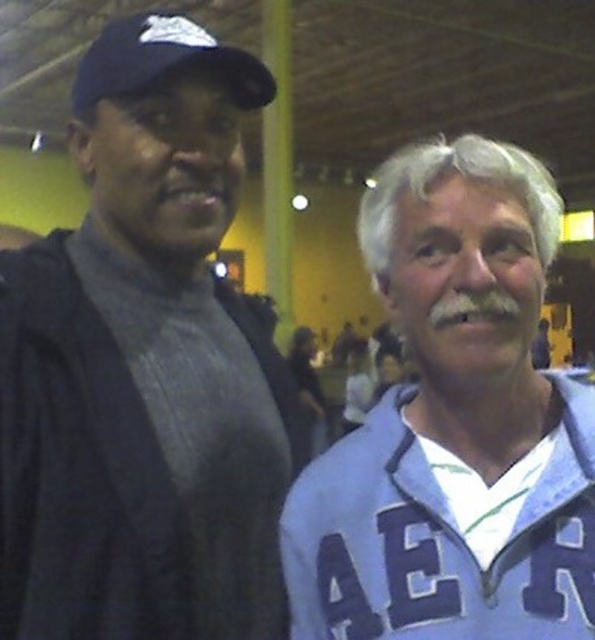
Is dark gray knit sweater at left above blue fleece jacket at right?

Yes, dark gray knit sweater at left is above blue fleece jacket at right.

Can you confirm if dark gray knit sweater at left is positioned to the right of blue fleece jacket at right?

Incorrect, dark gray knit sweater at left is not on the right side of blue fleece jacket at right.

Is point (87, 561) more distant than point (387, 458)?

Yes, it is.

Locate an element on the screen. dark gray knit sweater at left is located at coordinates (143, 368).

Between dark gray knit sweater at left and black matte baseball cap at upper left, which one appears on the left side from the viewer's perspective?

dark gray knit sweater at left is more to the left.

What do you see at coordinates (143, 368) in the screenshot?
I see `dark gray knit sweater at left` at bounding box center [143, 368].

Which is in front, point (105, 461) or point (180, 52)?

Point (105, 461) is in front.

The height and width of the screenshot is (640, 595). I want to click on dark gray knit sweater at left, so click(143, 368).

Is blue fleece jacket at right bigger than black matte baseball cap at upper left?

Yes, blue fleece jacket at right is bigger than black matte baseball cap at upper left.

Between point (575, 420) and point (95, 76), which one is positioned in front?

Point (575, 420) is in front.

Locate an element on the screen. Image resolution: width=595 pixels, height=640 pixels. blue fleece jacket at right is located at coordinates (439, 540).